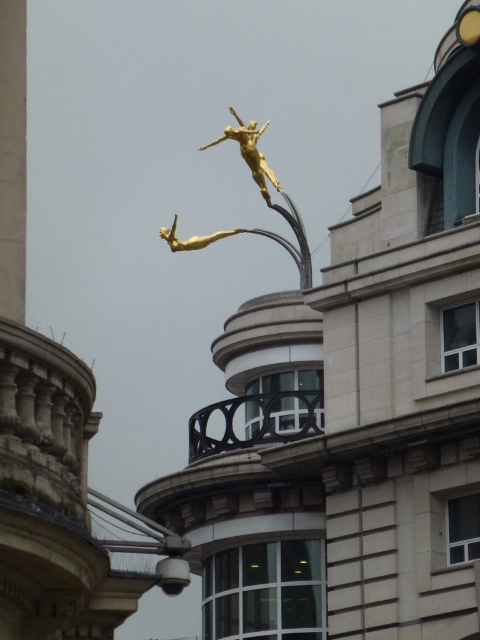
You are an art curator planning to install a new light fixture in the room. The light fixture needs to be placed between the gold metallic statue at upper center and the gold metallic statue at center. Given that the light fixture is 1.2 meters tall, will it fit vertically between them?

The gold metallic statue at upper center is taller than the gold metallic statue at center. However, the height difference between them isn not specified. Without knowing the exact heights or the vertical space between them, it is impossible to determine if the light fixture will fit.

You are an architect analyzing the proportions of the scene. Which object is shorter between the smooth white pillar at left and the gold metallic statue at upper center?

The smooth white pillar at left is shorter than the gold metallic statue at upper center.

You are an architect designing a new plaza and want to place a bench between the smooth white pillar at left and the gold metallic statue at center. If the bench requires 2 meters of space, can it fit between them based on their widths?

The smooth white pillar at left is narrower than the gold metallic statue at center. However, the description only provides information about their widths relative to each other, not their exact measurements. Without knowing the actual width of either object, it is impossible to determine if the 2 meters of space required for the bench is sufficient.